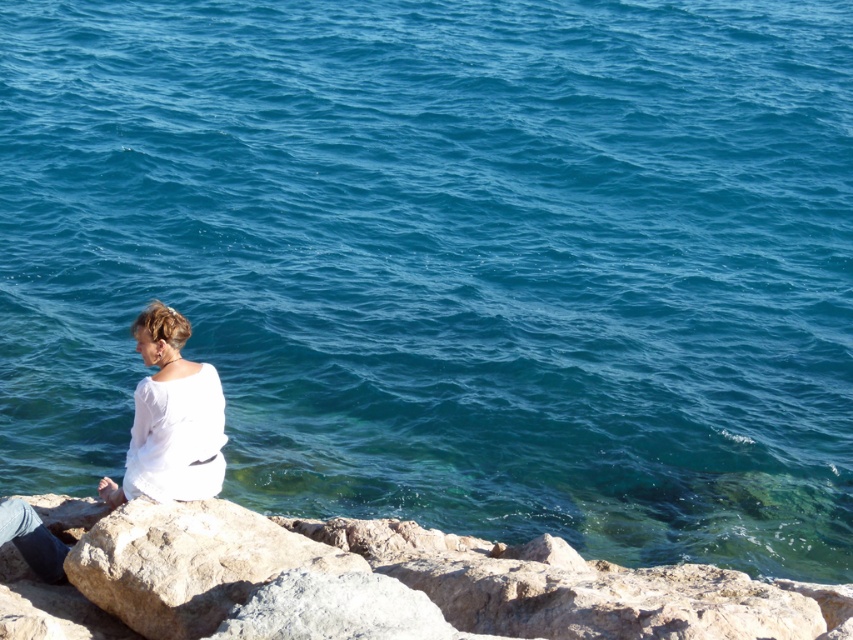
Question: Does gray rough rock at lower left lie behind white cotton shirt at lower left?

Choices:
 (A) yes
 (B) no

Answer: (B)

Question: Is gray rough rock at lower left to the left of white cotton shirt at lower left from the viewer's perspective?

Choices:
 (A) no
 (B) yes

Answer: (A)

Question: From the image, what is the correct spatial relationship of rough stone cliff at lower left in relation to gray rough rock at lower left?

Choices:
 (A) left
 (B) right

Answer: (B)

Question: Which object appears closest to the camera in this image?

Choices:
 (A) white cotton shirt at lower left
 (B) gray rough rock at lower left
 (C) rough stone cliff at lower left

Answer: (B)

Question: Which point is farther to the camera?

Choices:
 (A) gray rough rock at lower left
 (B) white cotton shirt at lower left

Answer: (B)

Question: Considering the real-world distances, which object is closest to the white cotton shirt at lower left?

Choices:
 (A) gray rough rock at lower left
 (B) rough stone cliff at lower left

Answer: (A)